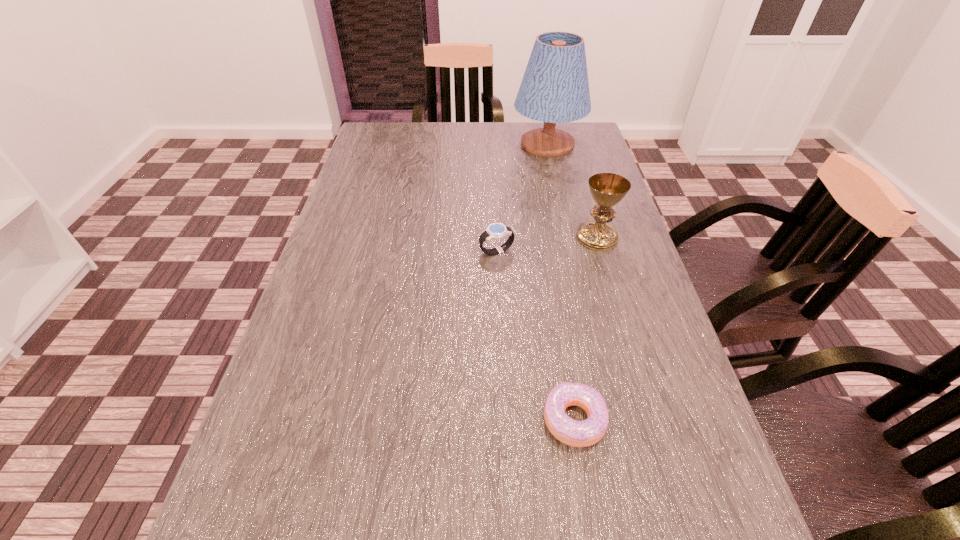
Find the location of a particular element. This screenshot has width=960, height=540. the second closest object to the second tallest object is located at coordinates (555, 89).

You are a GUI agent. You are given a task and a screenshot of the screen. Output one action in this format:
    pyautogui.click(x=<x>, y=<y>)
    Task: Click on the vacant area in the image that satisfies the following two spatial constraints: 1. on the back side of the second tallest object; 2. on the left side of the watch
    
    Given the screenshot: What is the action you would take?
    point(495,238)

The height and width of the screenshot is (540, 960). What are the coordinates of `vacant region that satisfies the following two spatial constraints: 1. on the back side of the nearest object; 2. on the right side of the third shortest object` in the screenshot? It's located at (544, 238).

Image resolution: width=960 pixels, height=540 pixels. Find the location of `blank space that satisfies the following two spatial constraints: 1. on the back side of the shortest object; 2. on the left side of the farthest object`. blank space that satisfies the following two spatial constraints: 1. on the back side of the shortest object; 2. on the left side of the farthest object is located at coordinates (530, 144).

Locate an element on the screen. vacant region that satisfies the following two spatial constraints: 1. on the back side of the tallest object; 2. on the right side of the shortest object is located at coordinates (530, 144).